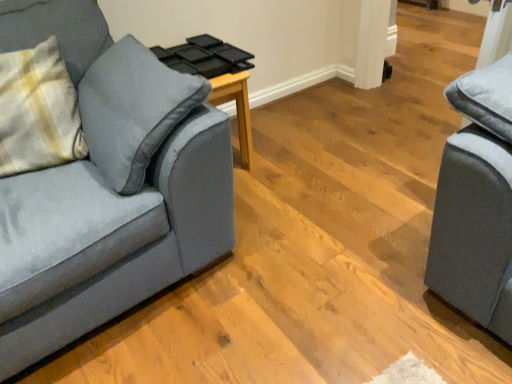
Question: Is wooden side table at center smaller than plaid fabric pillow at left?

Choices:
 (A) yes
 (B) no

Answer: (A)

Question: From a real-world perspective, is wooden side table at center positioned under plaid fabric pillow at left based on gravity?

Choices:
 (A) yes
 (B) no

Answer: (A)

Question: Is the depth of wooden side table at center greater than that of plaid fabric pillow at left?

Choices:
 (A) yes
 (B) no

Answer: (A)

Question: From the image's perspective, is wooden side table at center located beneath plaid fabric pillow at left?

Choices:
 (A) yes
 (B) no

Answer: (B)

Question: Can you confirm if wooden side table at center is shorter than plaid fabric pillow at left?

Choices:
 (A) no
 (B) yes

Answer: (B)

Question: Considering the positions of plaid fabric pillow at left and wooden side table at center in the image, is plaid fabric pillow at left wider or thinner than wooden side table at center?

Choices:
 (A) thin
 (B) wide

Answer: (A)

Question: Does point (34, 69) appear closer or farther from the camera than point (221, 51)?

Choices:
 (A) farther
 (B) closer

Answer: (B)

Question: In terms of size, does plaid fabric pillow at left appear bigger or smaller than wooden side table at center?

Choices:
 (A) big
 (B) small

Answer: (A)

Question: From the image's perspective, is plaid fabric pillow at left positioned above or below wooden side table at center?

Choices:
 (A) below
 (B) above

Answer: (A)

Question: In terms of height, does wooden side table at center look taller or shorter compared to plaid fabric pillow at left?

Choices:
 (A) tall
 (B) short

Answer: (B)

Question: Choose the correct answer: Is wooden side table at center inside plaid fabric pillow at left or outside it?

Choices:
 (A) outside
 (B) inside

Answer: (A)

Question: Considering the positions of wooden side table at center and plaid fabric pillow at left in the image, is wooden side table at center wider or thinner than plaid fabric pillow at left?

Choices:
 (A) thin
 (B) wide

Answer: (B)

Question: Visually, is wooden side table at center positioned to the left or to the right of plaid fabric pillow at left?

Choices:
 (A) left
 (B) right

Answer: (B)

Question: Considering their positions, is plaid fabric pillow at left located in front of or behind velvet gray couch at left?

Choices:
 (A) front
 (B) behind

Answer: (B)

Question: Considering the positions of plaid fabric pillow at left and velvet gray couch at left in the image, is plaid fabric pillow at left wider or thinner than velvet gray couch at left?

Choices:
 (A) thin
 (B) wide

Answer: (A)